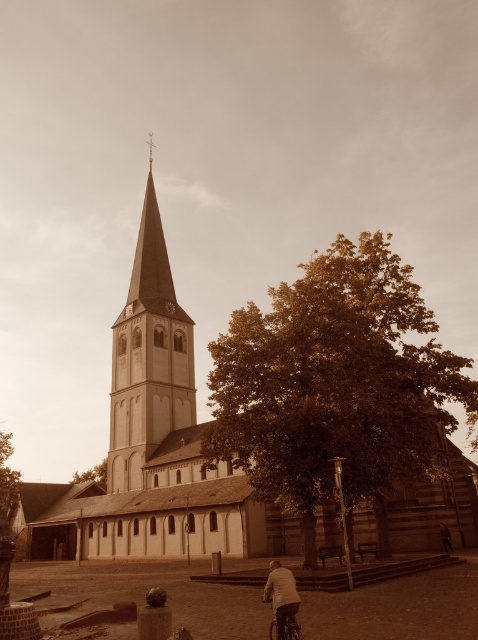
You are standing at the camera position and want to know the location of the light beige stone church at center. What are its coordinates?

The light beige stone church at center is located at point (152, 449).

You are standing on the paved area in front of the church and want to take a photo of the shiny metallic bicycle at lower center without the smooth stone spire at center blocking the view. Is this possible given their sizes?

The smooth stone spire at center is much taller than the shiny metallic bicycle at lower center, so if you position yourself far enough away from the spire, you might be able to frame the bicycle without the spire blocking the view.

You are standing at the front of the church and want to see both the light brown leather jacket at lower right and the shiny metallic bicycle at lower center. Which object is taller?

The light brown leather jacket at lower right is taller than the shiny metallic bicycle at lower center according to the description.